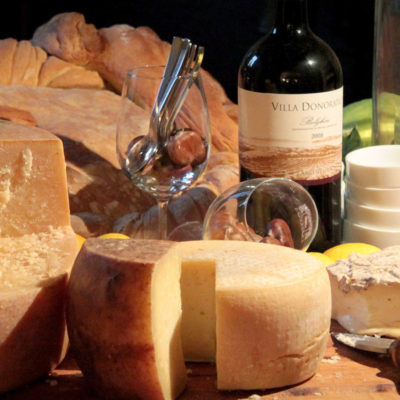
You are a GUI agent. You are given a task and a screenshot of the screen. Output one action in this format:
    pyautogui.click(x=<x>, y=<y>)
    Task: Click on the spoon
    The height and width of the screenshot is (400, 400).
    Given the screenshot: What is the action you would take?
    pyautogui.click(x=135, y=151)